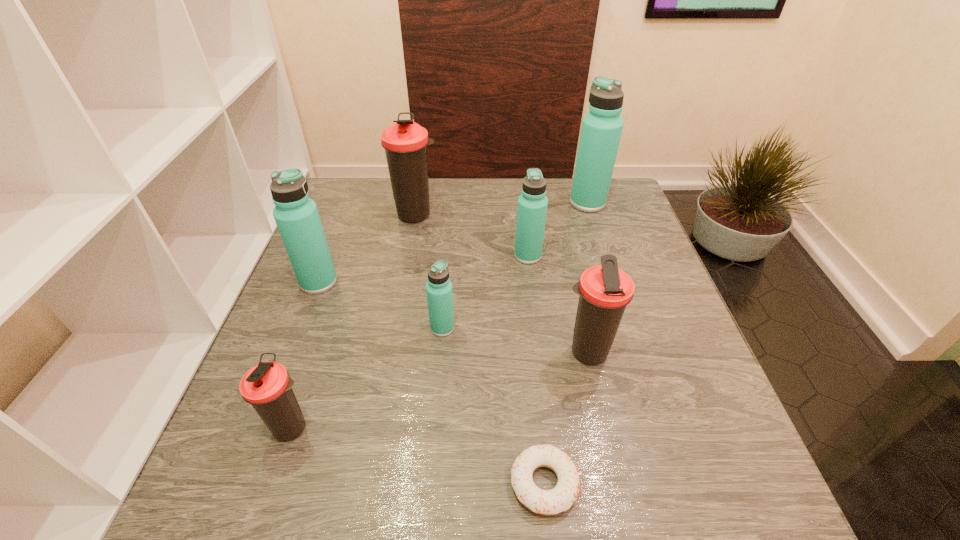
You are a GUI agent. You are given a task and a screenshot of the screen. Output one action in this format:
    pyautogui.click(x=<x>, y=<y>)
    Task: Click on the free space in the image that satisfies the following two spatial constraints: 1. on the back side of the shortest object; 2. on the right side of the second aqua thermos bottle from right to left
    The height and width of the screenshot is (540, 960).
    Given the screenshot: What is the action you would take?
    pyautogui.click(x=520, y=255)

Where is `blank space that satisfies the following two spatial constraints: 1. on the back side of the second nearest object; 2. on the right side of the fourth object from left to right`? blank space that satisfies the following two spatial constraints: 1. on the back side of the second nearest object; 2. on the right side of the fourth object from left to right is located at coordinates (325, 328).

Find the location of a particular element. vacant position in the image that satisfies the following two spatial constraints: 1. on the front side of the sixth object from right to left; 2. on the left side of the nearest object is located at coordinates (368, 483).